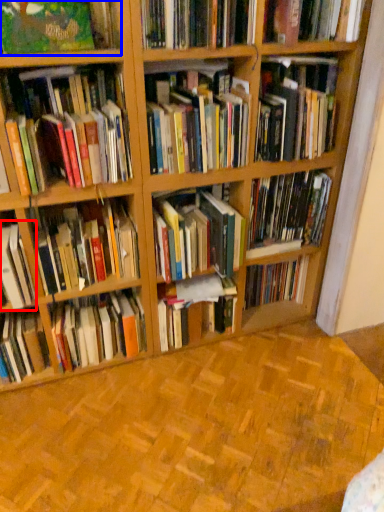
Question: Which of the following is the closest to the observer, book (highlighted by a red box) or book (highlighted by a blue box)?

Choices:
 (A) book
 (B) book

Answer: (B)